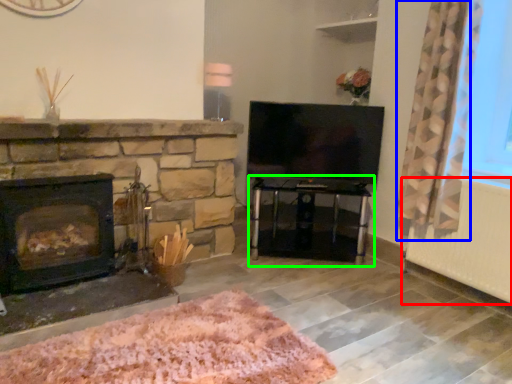
Question: Estimate the real-world distances between objects in this image. Which object is closer to radiator (highlighted by a red box), curtain (highlighted by a blue box) or table (highlighted by a green box)?

Choices:
 (A) curtain
 (B) table

Answer: (A)